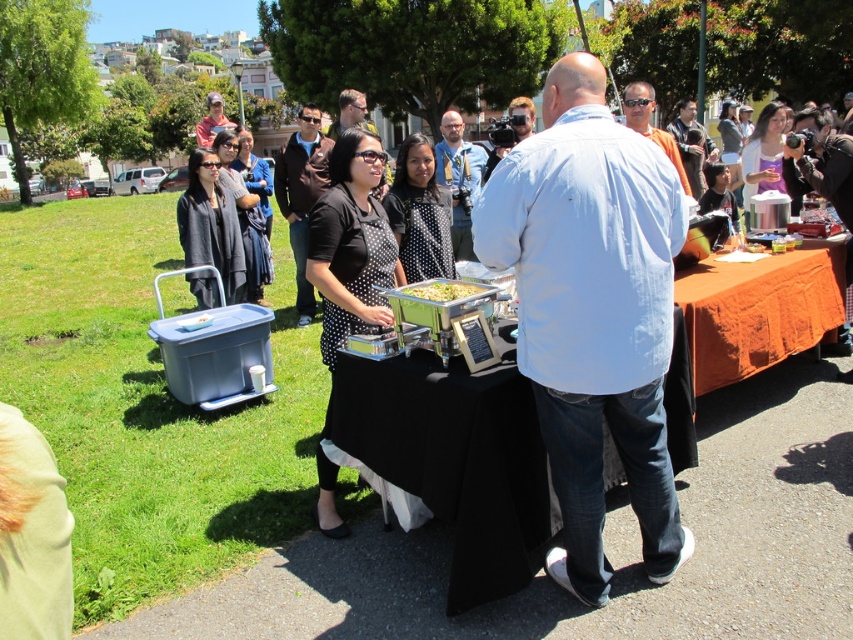
You are at a park event and see two people dressed in matte black shirt at center and matte gray shirt at upper center. Which person is standing closer to you?

The matte black shirt at center is shorter than the matte gray shirt at upper center, so the matte black shirt at center is closer to you.

You are at a park event and see two people in matte black shirt at center and matte gray shirt at upper center. Which one is positioned more to the right side?

The matte black shirt at center is positioned more to the right side than the matte gray shirt at upper center.